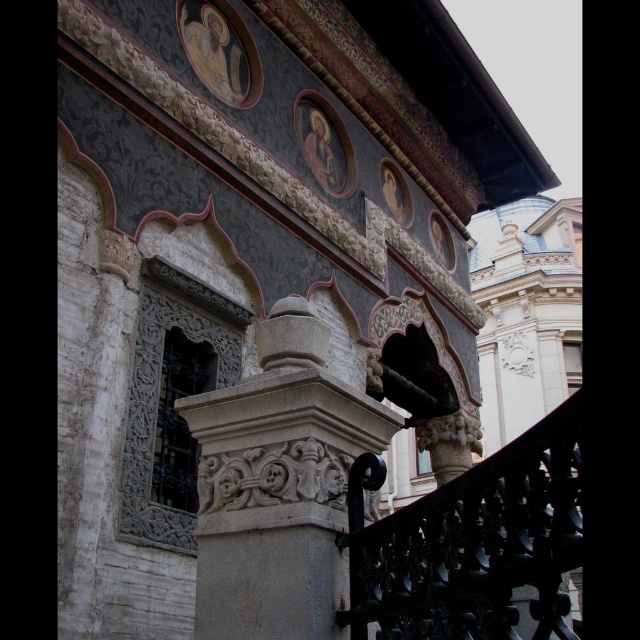
You are an architect examining the structure. You need to determine the vertical relationship between the carved stone column at center and the black wrought iron at lower right. Which one is positioned higher?

The carved stone column at center is positioned higher than the black wrought iron at lower right because it is above it.

You are an architect examining this structure. You notice the carved stone column at center and the black wrought iron at lower right. Based on their heights, which one would require a taller ladder to reach its top?

The black wrought iron at lower right requires a taller ladder since it has a greater height than the carved stone column at center.